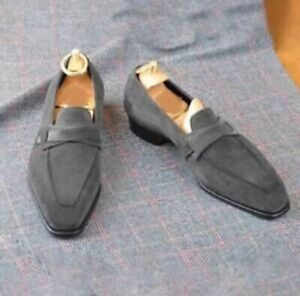
This screenshot has width=300, height=296. Find the location of `space behind shoes`. space behind shoes is located at coordinates (106, 16).